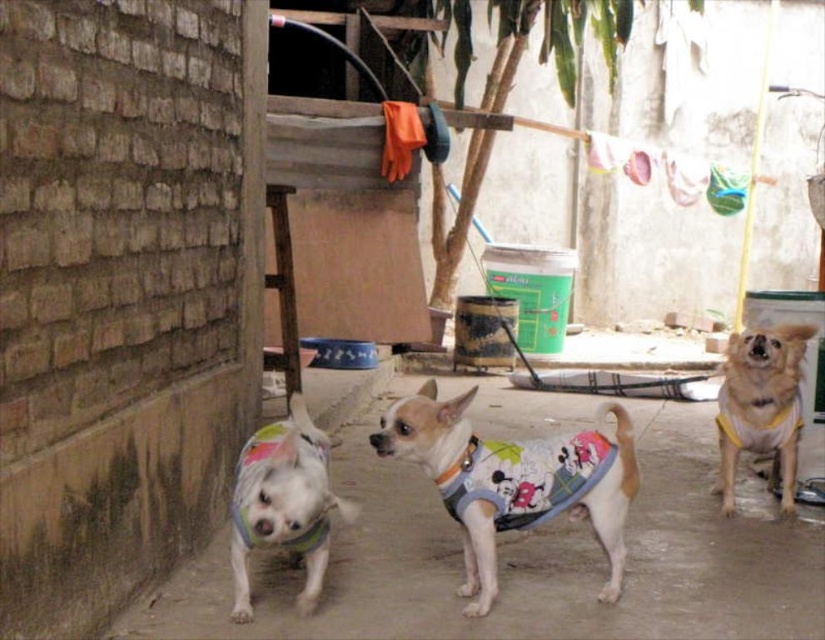
Question: Where is white fabric dog at center located in relation to yellow fabric dog at center in the image?

Choices:
 (A) right
 (B) left

Answer: (B)

Question: Does white fabric dog at center lie in front of yellow fabric dog at center?

Choices:
 (A) yes
 (B) no

Answer: (A)

Question: Based on their relative distances, which object is nearer to the white soft fabric dog at center?

Choices:
 (A) white fabric dog at center
 (B) yellow fabric dog at center

Answer: (A)

Question: Considering the real-world distances, which object is farthest from the white soft fabric dog at center?

Choices:
 (A) yellow fabric dog at center
 (B) white fabric dog at center

Answer: (A)

Question: Which object appears farthest from the camera in this image?

Choices:
 (A) yellow fabric dog at center
 (B) white soft fabric dog at center

Answer: (A)

Question: Is white fabric dog at center wider than yellow fabric dog at center?

Choices:
 (A) yes
 (B) no

Answer: (A)